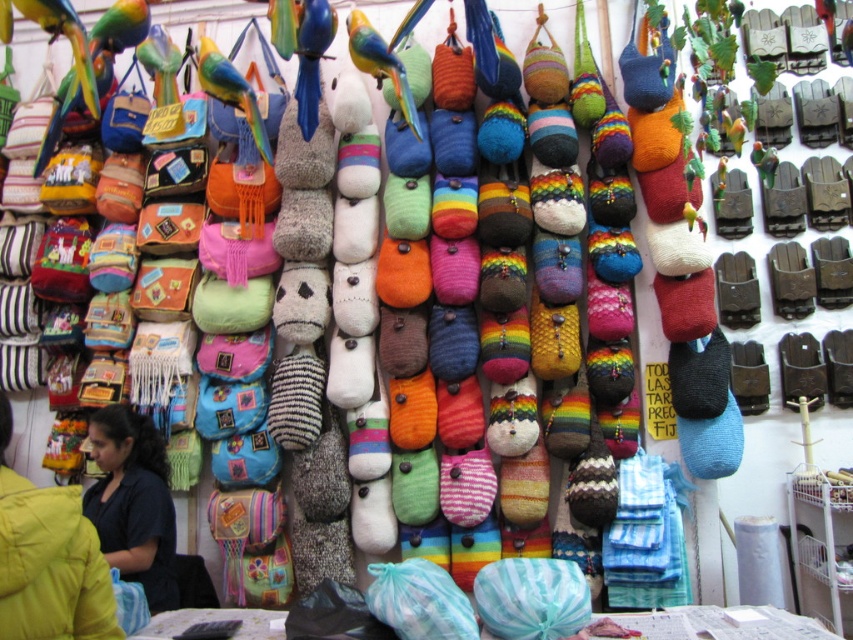
Question: Which object is farther from the camera taking this photo?

Choices:
 (A) dark blue fabric at lower left
 (B) black fabric at lower left

Answer: (A)

Question: Among these objects, which one is nearest to the camera?

Choices:
 (A) black fabric at lower left
 (B) dark blue fabric at lower left

Answer: (A)

Question: From the image, what is the correct spatial relationship of black fabric at lower left in relation to dark blue fabric at lower left?

Choices:
 (A) left
 (B) right

Answer: (B)

Question: Among these points, which one is nearest to the camera?

Choices:
 (A) (85, 518)
 (B) (120, 460)

Answer: (A)

Question: Can you confirm if black fabric at lower left is bigger than dark blue fabric at lower left?

Choices:
 (A) yes
 (B) no

Answer: (B)

Question: Where is black fabric at lower left located in relation to dark blue fabric at lower left in the image?

Choices:
 (A) below
 (B) above

Answer: (B)